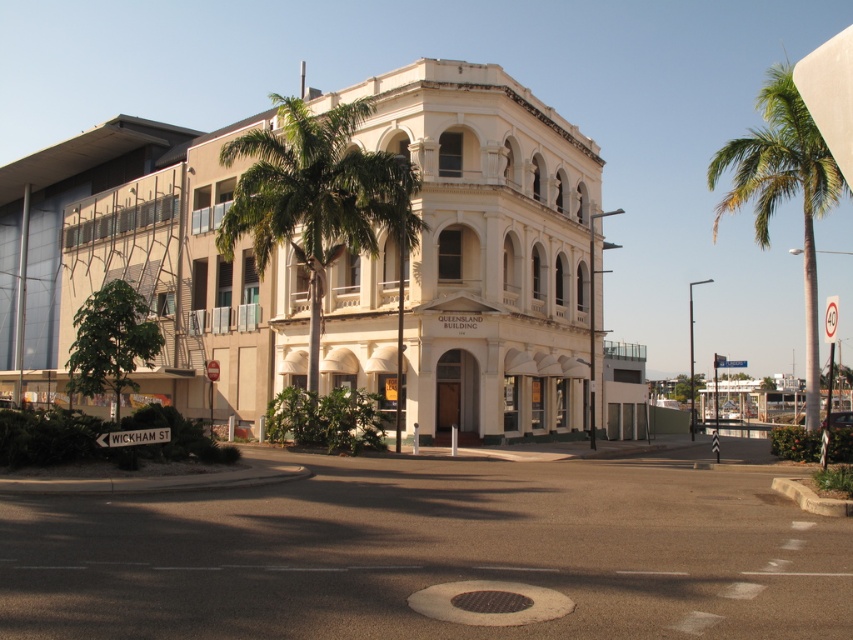
Is green leafy palm tree at right thinner than white plastic street sign at lower left?

No, green leafy palm tree at right is not thinner than white plastic street sign at lower left.

Is green leafy palm tree at right smaller than white plastic street sign at lower left?

No, green leafy palm tree at right is not smaller than white plastic street sign at lower left.

The height and width of the screenshot is (640, 853). In order to click on green leafy palm tree at right in this screenshot , I will do `click(782, 189)`.

Which is more to the right, smooth asphalt road at center or green leafy palm tree at center?

From the viewer's perspective, smooth asphalt road at center appears more on the right side.

Between smooth asphalt road at center and green leafy palm tree at center, which one is positioned higher?

green leafy palm tree at center is above.

Which is in front, point (599, 602) or point (306, 113)?

Point (599, 602) is in front.

You are a GUI agent. You are given a task and a screenshot of the screen. Output one action in this format:
    pyautogui.click(x=<x>, y=<y>)
    Task: Click on the smooth asphalt road at center
    
    Given the screenshot: What is the action you would take?
    pyautogui.click(x=430, y=554)

Which is below, smooth asphalt road at center or white plastic street sign at lower left?

smooth asphalt road at center

Is smooth asphalt road at center wider than white plastic street sign at lower left?

Correct, the width of smooth asphalt road at center exceeds that of white plastic street sign at lower left.

Find the location of a particular element. Image resolution: width=853 pixels, height=640 pixels. smooth asphalt road at center is located at coordinates (430, 554).

In order to click on smooth asphalt road at center in this screenshot , I will do `click(430, 554)`.